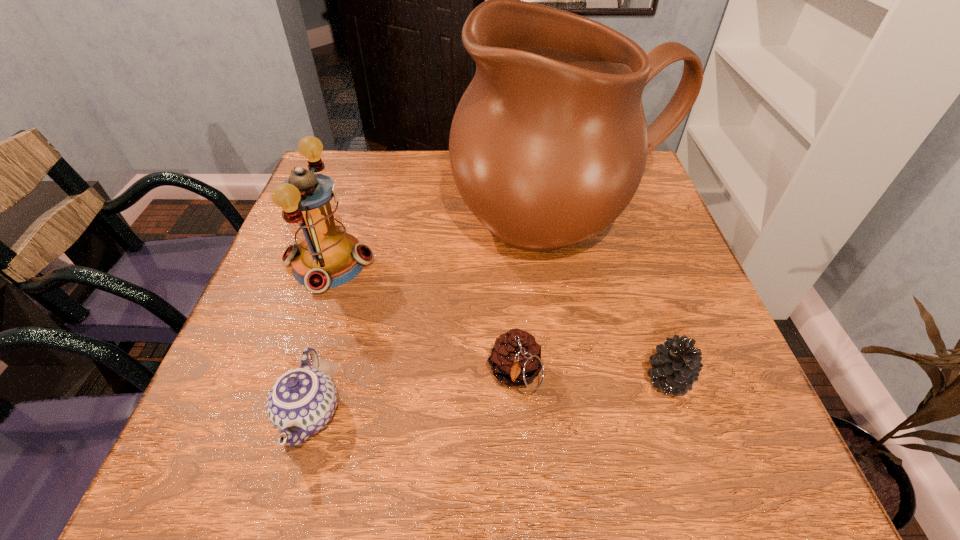
At what (x,y) coordinates should I click in order to perform the action: click on free space in the image that satisfies the following two spatial constraints: 1. at the spout of the tallest object; 2. on the front-facing side of the second tallest object. Please return your answer as a coordinate pair (x, y). This screenshot has width=960, height=540. Looking at the image, I should click on (569, 263).

This screenshot has height=540, width=960. Find the location of `vacant space that satisfies the following two spatial constraints: 1. at the spout of the right pinecone; 2. on the right side of the tallest object`. vacant space that satisfies the following two spatial constraints: 1. at the spout of the right pinecone; 2. on the right side of the tallest object is located at coordinates (593, 380).